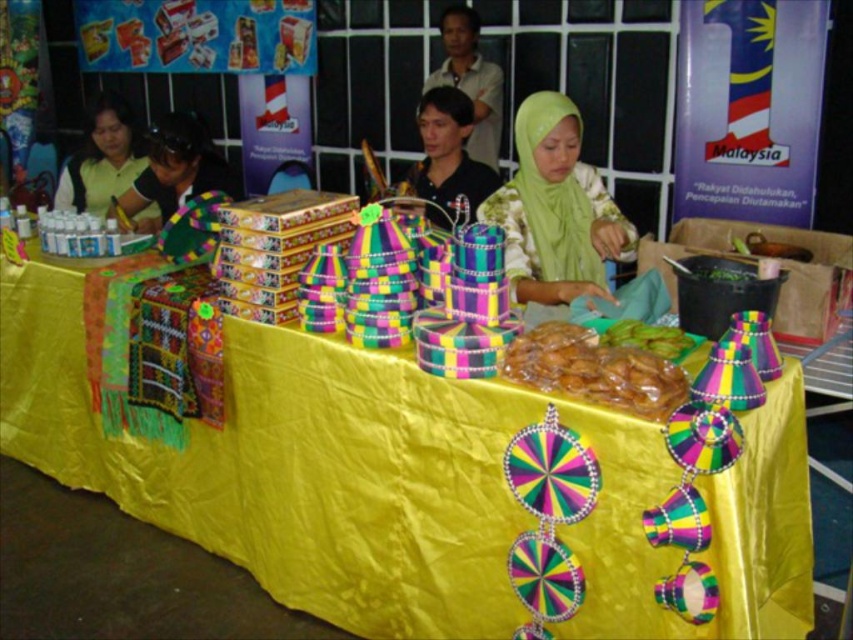
You are an event organizer at the Malaysia cultural event. You need to place a new decorative item on the table. The item is a small statue that must be placed above the translucent plastic bag at center but not overlapping with the black fabric headscarf at upper left. Is this possible?

The translucent plastic bag at center is below the black fabric headscarf at upper left, so placing the statue above the bag would mean placing it below the headscarf. Therefore, it is possible to position the statue between them without overlapping.